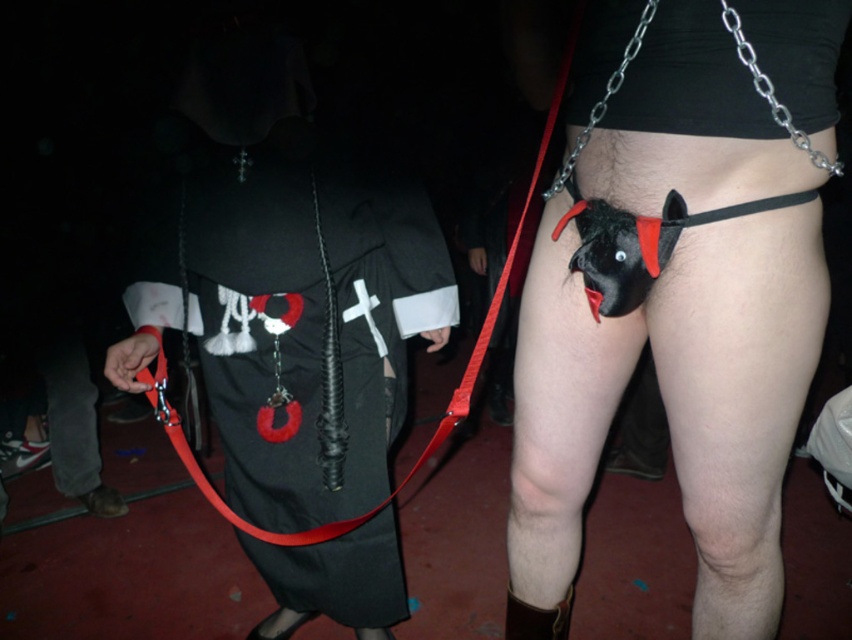
You are a photographer at the event and want to take a photo that includes both the point at (x=574, y=349) and the point at (x=107, y=484). Which point should you focus on to ensure both are in sharp focus?

You should focus on point (x=574, y=349) because it is closer to the camera, and focusing on the closer object will keep both in focus due to the depth of field.

You are standing in the middle of the room and want to move towards the two points marked in the scene. Which point, point (540,362) or point (528,616), will you reach first?

Point (540,362) is closer to the viewer than point (528,616), so you will reach point (540,362) first.

You are a photographer at the event and need to capture a photo that includes both the matte black costume at center and the brown suede boot at lower left. The camera you are using has a maximum focus range of 4 feet. Can you take the photo without moving either object?

The matte black costume at center is 4.09 feet away from the brown suede boot at lower left. Since the distance is slightly over the camera maximum focus range of 4 feet, you cannot take the photo without moving either object.